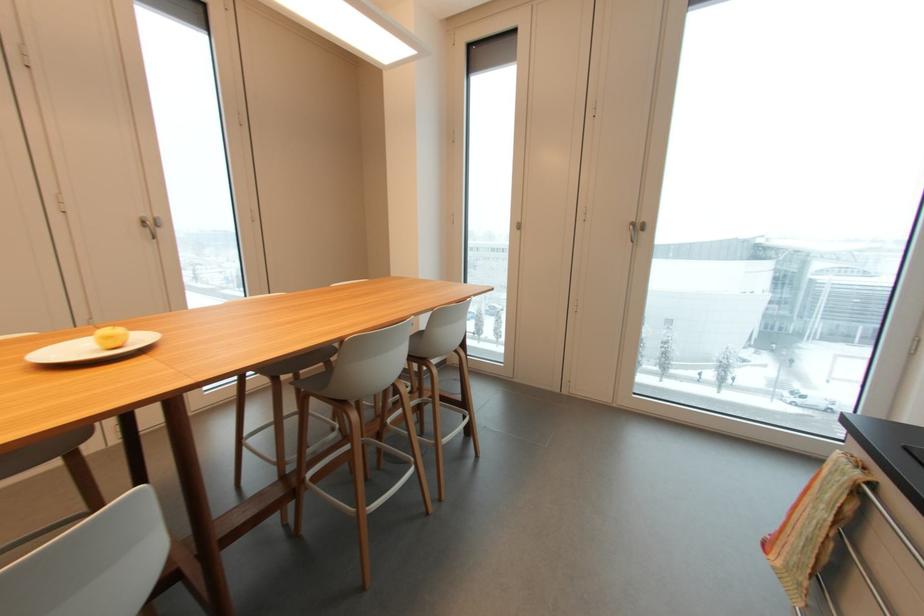
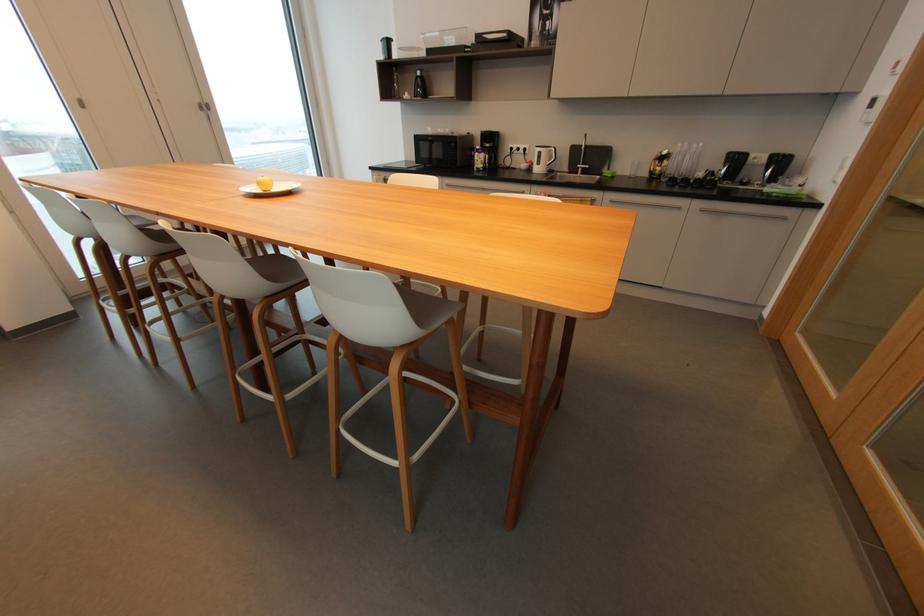
Find the pixel in the second image that matches (x=520, y=225) in the first image.

(81, 103)